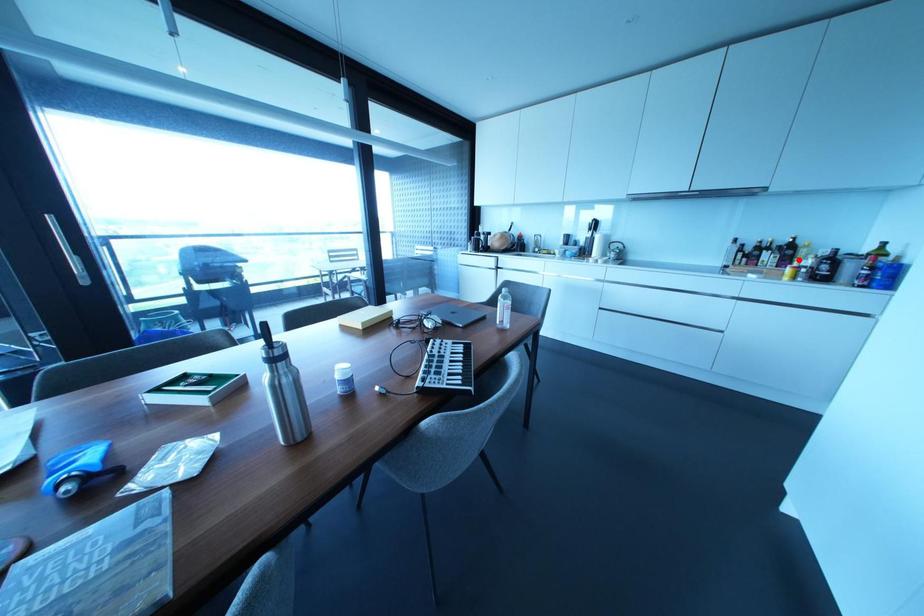
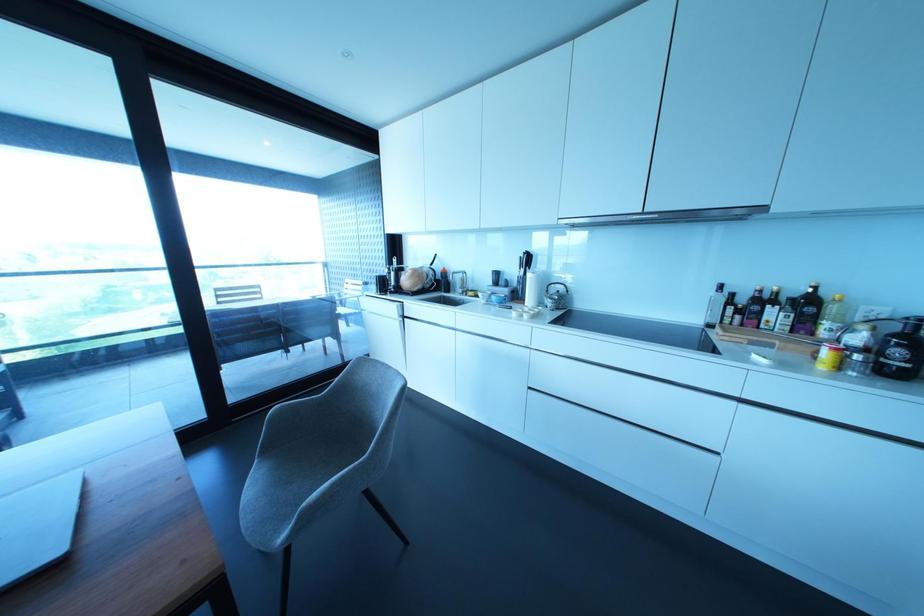
In the second image, find the point that corresponds to the highlighted location in the first image.

(825, 323)